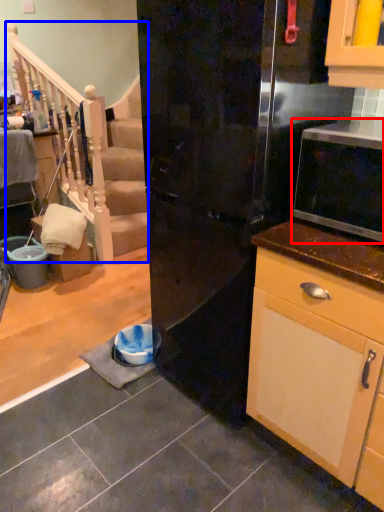
Question: Which point is further to the camera, microwave oven (highlighted by a red box) or rail (highlighted by a blue box)?

Choices:
 (A) microwave oven
 (B) rail

Answer: (B)